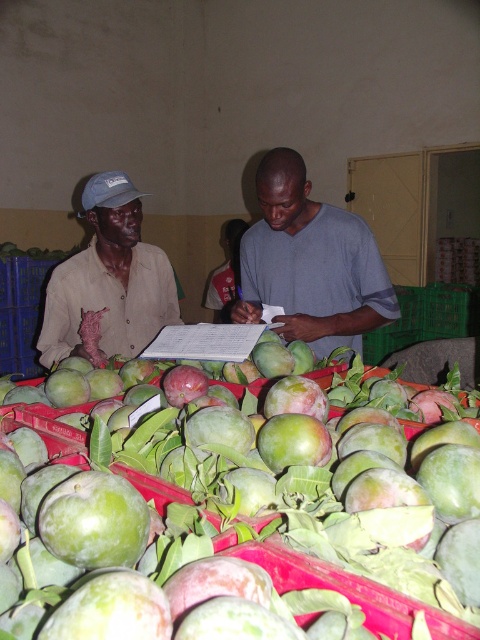
What are the coordinates of the green matte mangoes at center in the image?

The green matte mangoes at center are located at coordinates point (245, 524).

You are standing in the market stall and see a point at coordinates (311, 262). Which object from the scene does this point lie on?

The point at coordinates (311, 262) lies on the gray matte shirt at center.